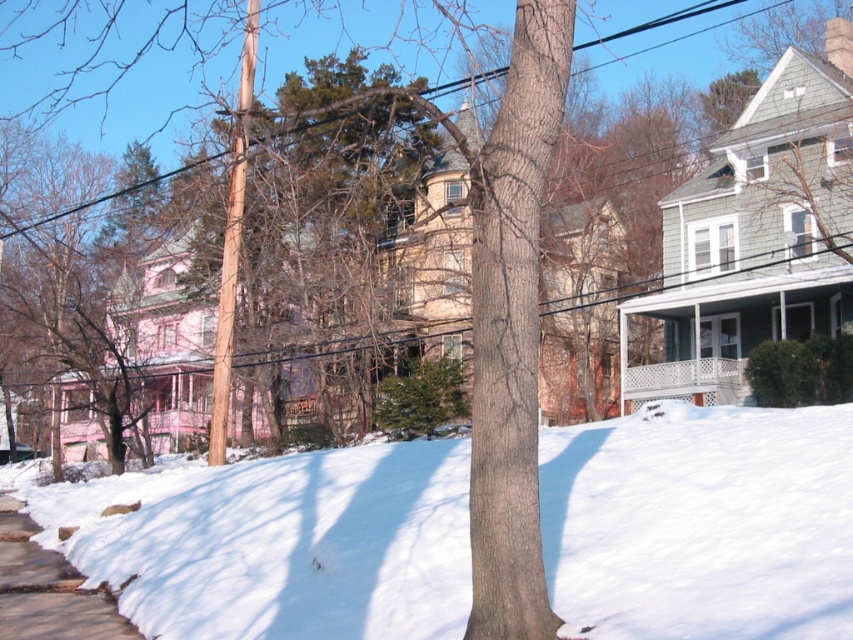
Question: Can you confirm if white fluffy snow at lower center is wider than smooth concrete sidewalk at lower left?

Choices:
 (A) no
 (B) yes

Answer: (B)

Question: Does white fluffy snow at lower center come behind smooth concrete sidewalk at lower left?

Choices:
 (A) no
 (B) yes

Answer: (A)

Question: Which point is closer to the camera?

Choices:
 (A) (26, 579)
 (B) (721, 563)

Answer: (B)

Question: Can you confirm if white fluffy snow at lower center is bigger than smooth concrete sidewalk at lower left?

Choices:
 (A) yes
 (B) no

Answer: (A)

Question: Which object is closer to the camera taking this photo?

Choices:
 (A) white fluffy snow at lower center
 (B) smooth concrete sidewalk at lower left

Answer: (A)